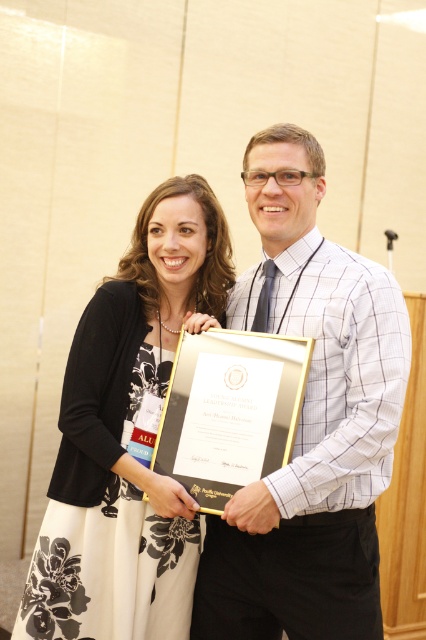
In the scene shown: Is white checkered shirt at center positioned at the back of gold metallic plaque at center?

That is False.

Is point (213, 570) in front of point (143, 497)?

No, it is behind (143, 497).

Is point (250, 625) positioned behind point (215, 444)?

That is True.

Locate an element on the screen. This screenshot has height=640, width=426. white checkered shirt at center is located at coordinates (308, 420).

Who is more forward, (152, 250) or (279, 372)?

Positioned in front is point (279, 372).

How far apart are black floral dress at center and gold metallic plaque at center?

They are 20.16 centimeters apart.

Does point (115, 541) lie behind point (184, 451)?

Yes, point (115, 541) is farther from viewer.

Find the location of a particular element. The image size is (426, 640). black floral dress at center is located at coordinates (127, 436).

Does white checkered shirt at center have a lesser height compared to black floral dress at center?

No, white checkered shirt at center is not shorter than black floral dress at center.

Which is more to the left, white checkered shirt at center or black floral dress at center?

black floral dress at center is more to the left.

Where is `white checkered shirt at center`? The image size is (426, 640). white checkered shirt at center is located at coordinates (308, 420).

Find the location of a particular element. The height and width of the screenshot is (640, 426). white checkered shirt at center is located at coordinates point(308,420).